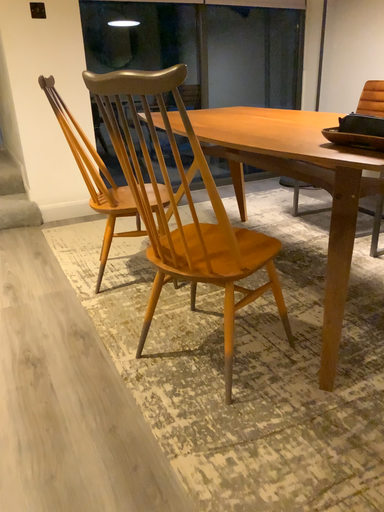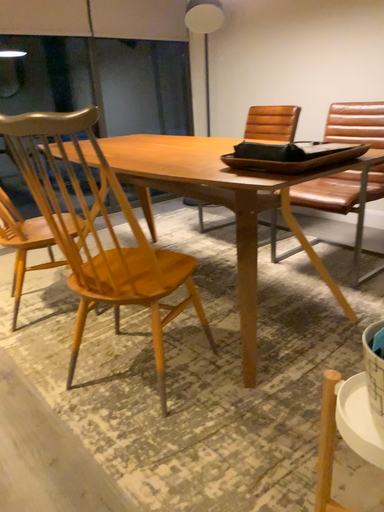
Question: Which way did the camera rotate in the video?

Choices:
 (A) rotated left
 (B) rotated right

Answer: (B)